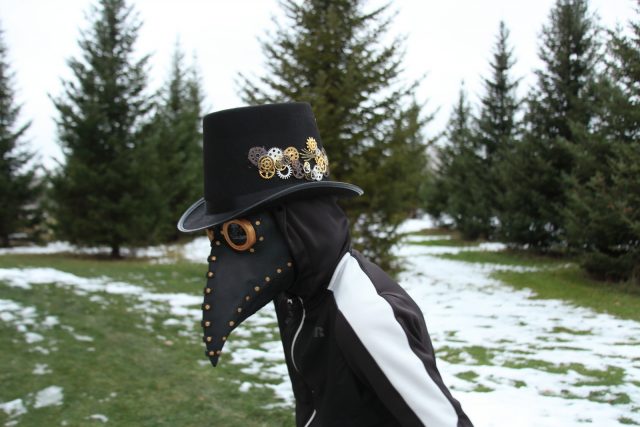
At what (x,y) coordinates should I click in order to perform the action: click on hood. Please return your answer as a coordinate pair (x, y). The height and width of the screenshot is (427, 640). Looking at the image, I should click on (322, 224).